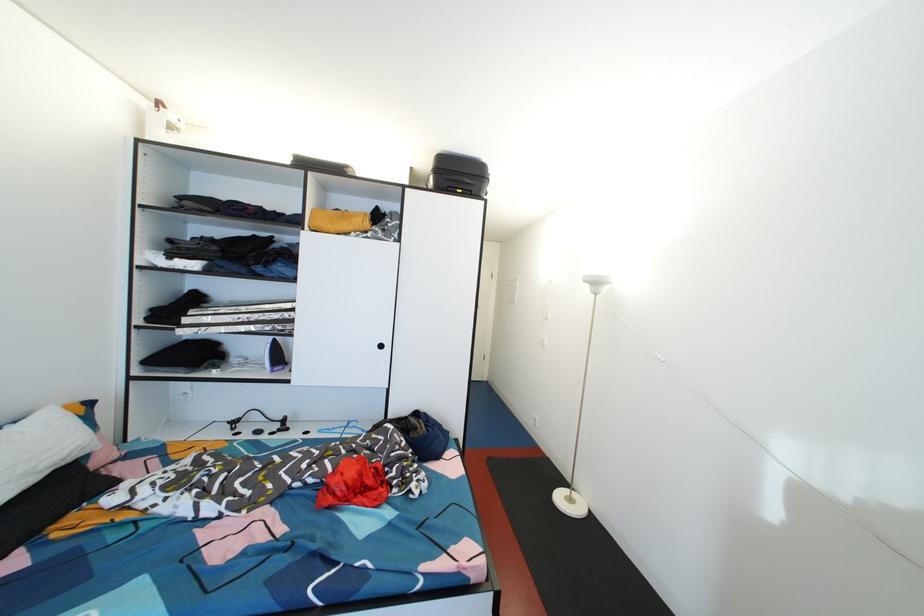
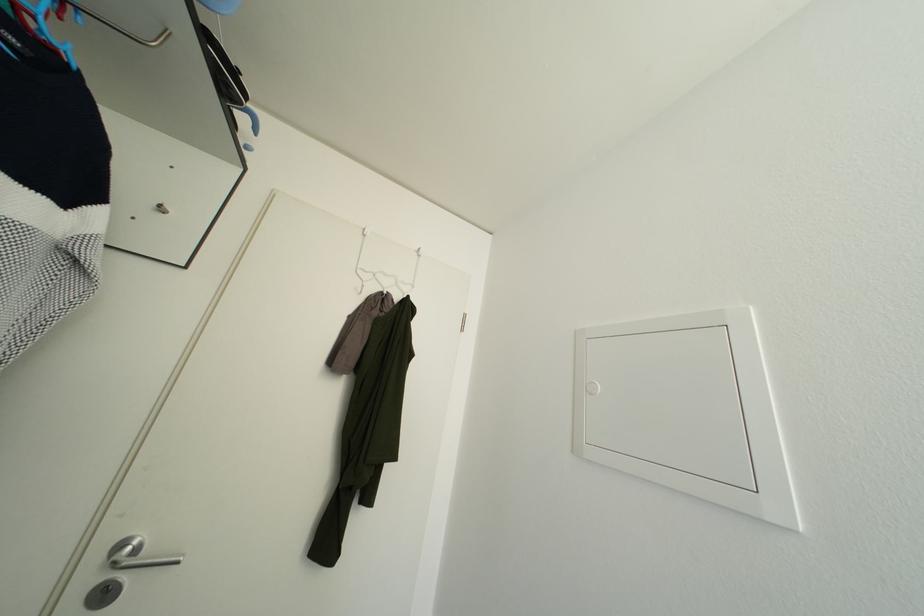
Question: Which direction would the cameraman need to move to produce the second image? Reply with the corresponding letter.

Choices:
 (A) Left
 (B) Right
 (C) Forward
 (D) Backward

Answer: (C)